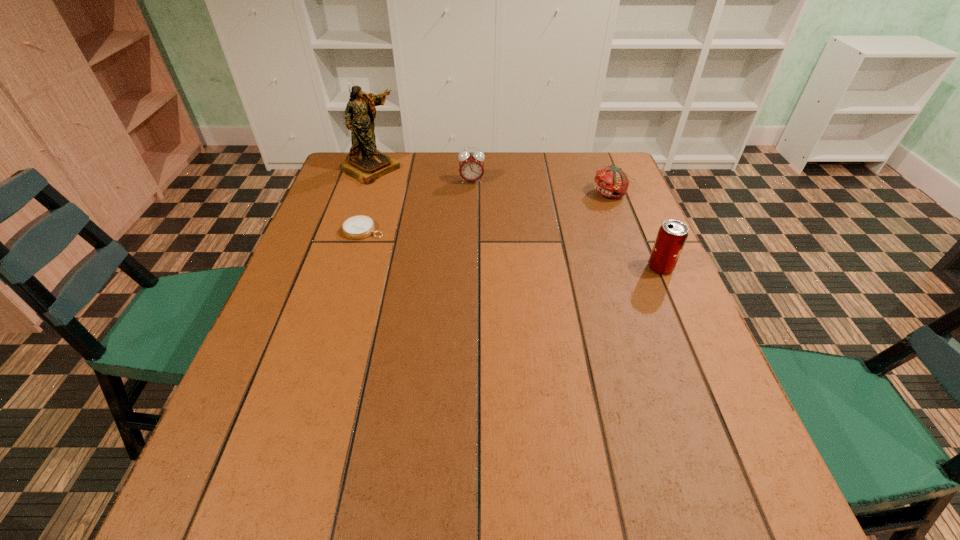
The height and width of the screenshot is (540, 960). Find the location of `free spot on the desktop that is between the compass and the nearest object and is positioned on the clock face of the alarm clock`. free spot on the desktop that is between the compass and the nearest object and is positioned on the clock face of the alarm clock is located at coordinates (471, 244).

The width and height of the screenshot is (960, 540). Find the location of `vacant space on the desktop that is between the compass and the nearest object and is positioned on the front-facing side of the second shortest object`. vacant space on the desktop that is between the compass and the nearest object and is positioned on the front-facing side of the second shortest object is located at coordinates (535, 252).

Find the location of a particular element. This screenshot has width=960, height=540. vacant spot on the desktop that is between the compass and the nearest object and is positioned on the front-facing side of the tallest object is located at coordinates (499, 247).